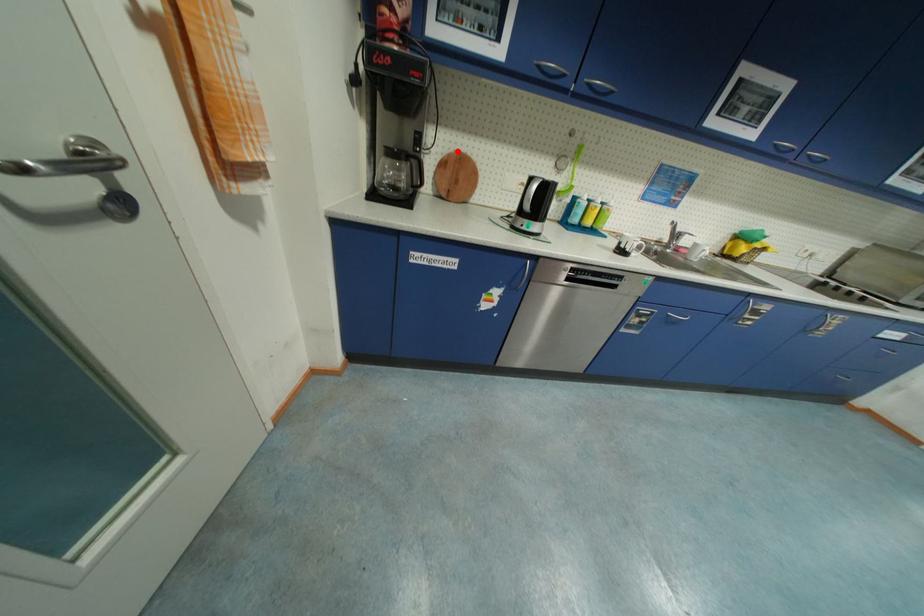
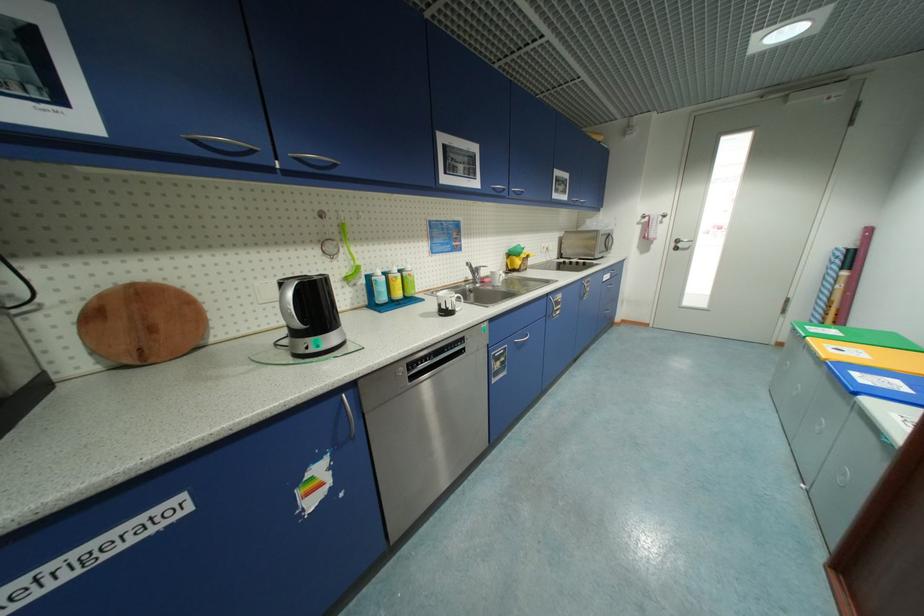
Where in the second image is the point corresponding to the highlighted location from the first image?

(114, 286)